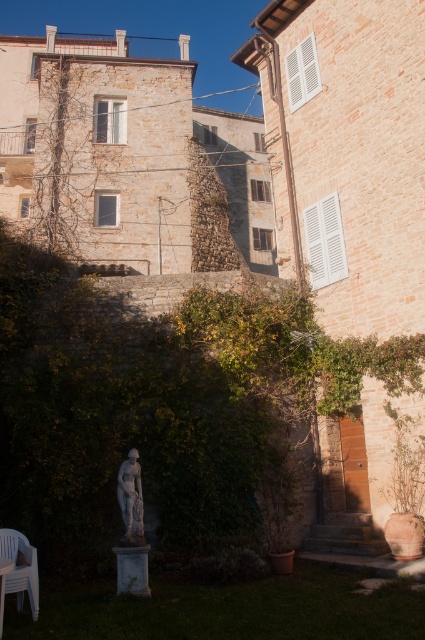
Question: Which of these objects is positioned closest to the plastic chair at lower left?

Choices:
 (A) green leafy hedge at center
 (B) white plastic table at lower left

Answer: (B)

Question: Does gray stone statue at center have a lesser width compared to white plastic table at lower left?

Choices:
 (A) no
 (B) yes

Answer: (A)

Question: Can you confirm if plastic chair at lower left is wider than gray stone statue at center?

Choices:
 (A) yes
 (B) no

Answer: (A)

Question: Based on their relative distances, which object is farther from the plastic chair at lower left?

Choices:
 (A) white plastic table at lower left
 (B) green leafy hedge at center

Answer: (B)

Question: Which of the following is the farthest from the observer?

Choices:
 (A) white plastic table at lower left
 (B) green leafy hedge at center

Answer: (B)

Question: Where is gray stone statue at center located in relation to white plastic table at lower left in the image?

Choices:
 (A) above
 (B) below

Answer: (A)